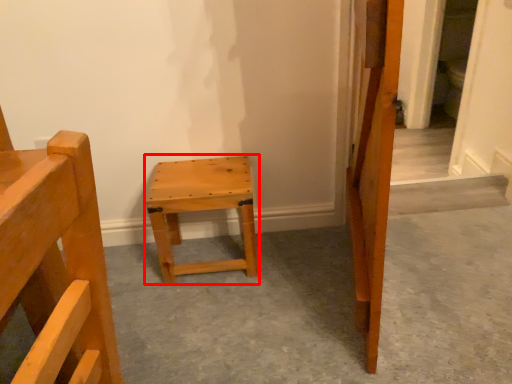
Question: From the image's perspective, where is stool (annotated by the red box) located in relation to concrete in the image?

Choices:
 (A) above
 (B) below

Answer: (A)